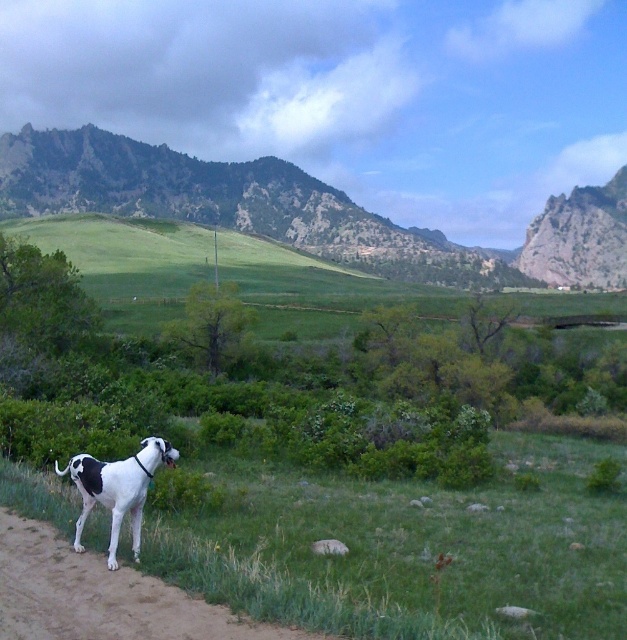
Question: Is the position of brown dirt track at lower left more distant than that of white glossy dog at lower left?

Choices:
 (A) yes
 (B) no

Answer: (B)

Question: Estimate the real-world distances between objects in this image. Which object is closer to the white glossy dog at lower left?

Choices:
 (A) brown dirt track at lower left
 (B) rugged brown mountain at upper left

Answer: (A)

Question: Which object is positioned farthest from the brown dirt track at lower left?

Choices:
 (A) white glossy dog at lower left
 (B) rugged brown mountain at upper left

Answer: (B)

Question: Does rugged brown mountain at upper left have a larger size compared to brown dirt track at lower left?

Choices:
 (A) no
 (B) yes

Answer: (B)

Question: Can you confirm if rugged brown mountain at upper left is bigger than brown dirt track at lower left?

Choices:
 (A) yes
 (B) no

Answer: (A)

Question: Which object is the farthest from the rugged brown mountain at upper left?

Choices:
 (A) brown dirt track at lower left
 (B) white glossy dog at lower left

Answer: (A)